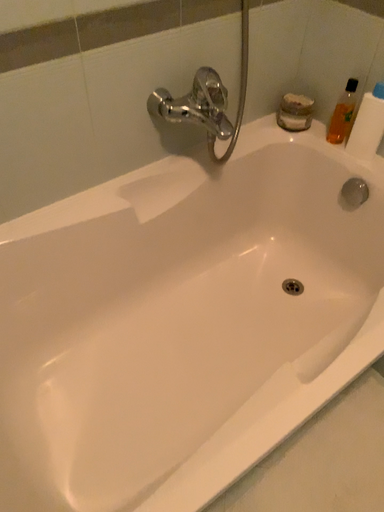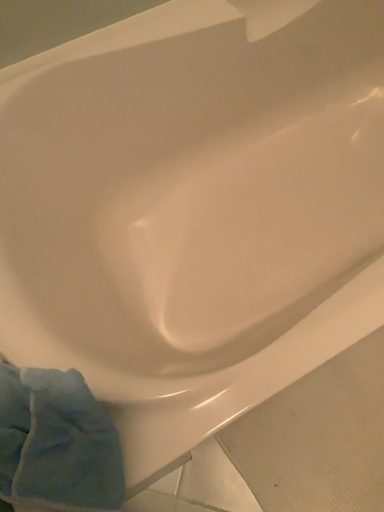
Question: How did the camera likely rotate when shooting the video?

Choices:
 (A) rotated right
 (B) rotated left

Answer: (B)